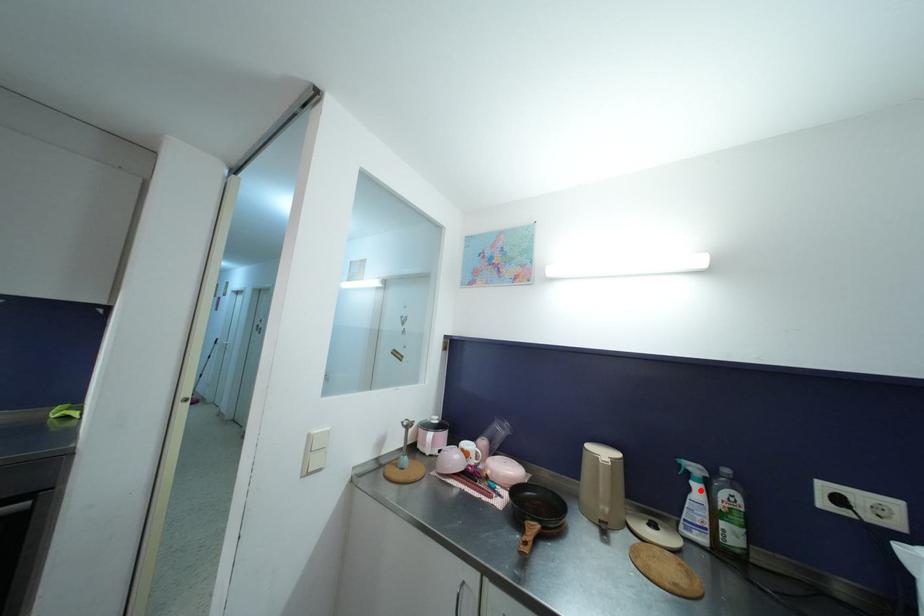
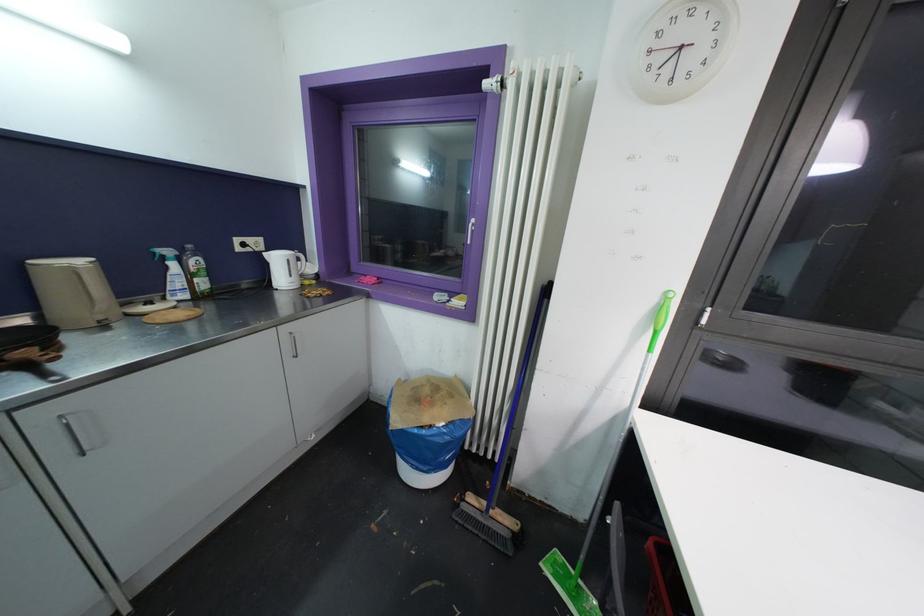
Where in the second image is the point corresponding to the highlighted location from the first image?

(176, 267)